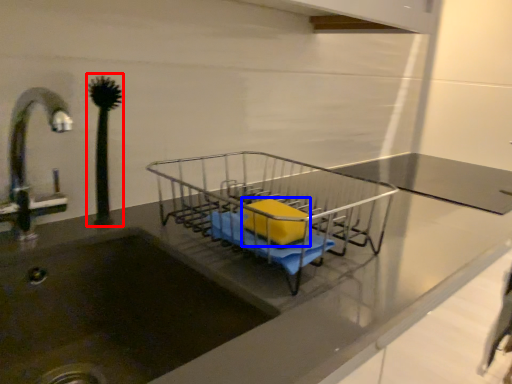
Question: Which object appears farthest to the camera in this image, plant (highlighted by a red box) or material (highlighted by a blue box)?

Choices:
 (A) plant
 (B) material

Answer: (A)